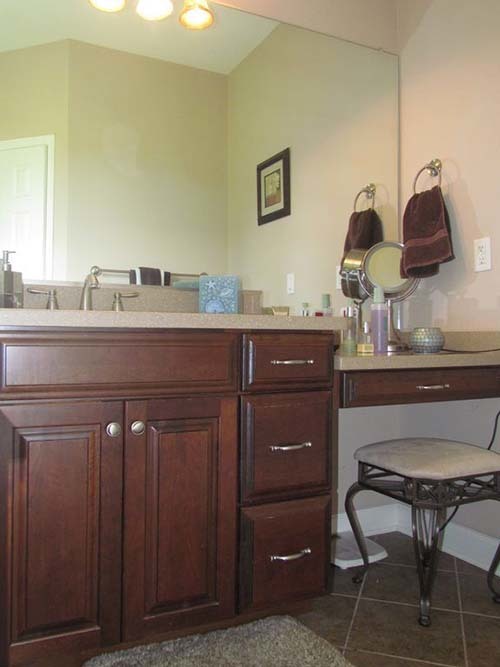
The image size is (500, 667). What are the coordinates of `walls` in the screenshot? It's located at (26, 93), (139, 221), (286, 241), (475, 193).